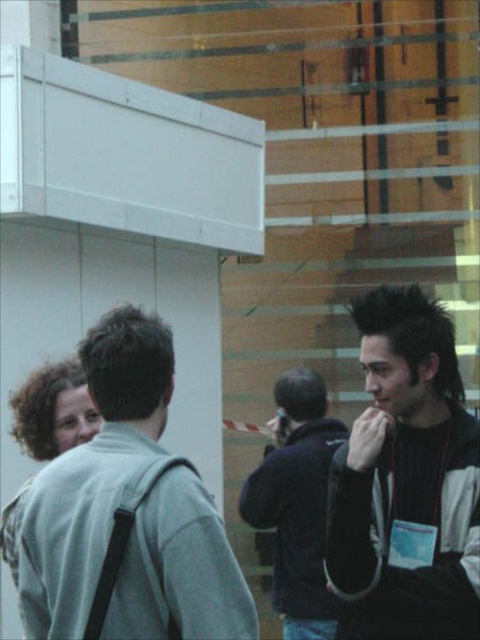
Can you confirm if black matte jacket at right is wider than dark blue hoodie at center?

Incorrect, black matte jacket at right's width does not surpass dark blue hoodie at center's.

Between black matte jacket at right and dark blue hoodie at center, which one has more height?

dark blue hoodie at center

Does point (421, 596) come in front of point (311, 525)?

Yes, it is in front of point (311, 525).

Image resolution: width=480 pixels, height=640 pixels. I want to click on black matte jacket at right, so click(406, 481).

Based on the photo, which is above, gray fabric jacket at left or black matte jacket at right?

gray fabric jacket at left

Locate an element on the screen. gray fabric jacket at left is located at coordinates (94, 472).

From the picture: Is gray fabric jacket at left bigger than curly brown hair at left?

Correct, gray fabric jacket at left is larger in size than curly brown hair at left.

Does gray fabric jacket at left have a lesser height compared to curly brown hair at left?

No, gray fabric jacket at left is not shorter than curly brown hair at left.

Image resolution: width=480 pixels, height=640 pixels. What do you see at coordinates (94, 472) in the screenshot? I see `gray fabric jacket at left` at bounding box center [94, 472].

Identify the location of gray fabric jacket at left. Image resolution: width=480 pixels, height=640 pixels. (94, 472).